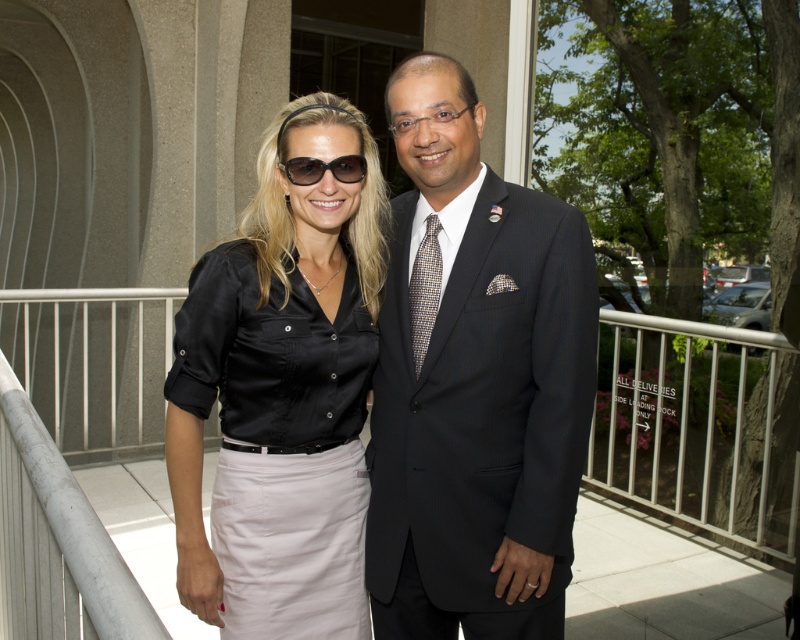
Between point (448, 552) and point (316, 524), which one is positioned in front?

Point (448, 552)

Does dark pinstripe suit at center lie behind satin black blouse at center?

Yes.

Who is more forward, (521,422) or (324,264)?

Point (521,422) is in front.

At what (x,y) coordinates should I click in order to perform the action: click on dark pinstripe suit at center. Please return your answer as a coordinate pair (x, y). This screenshot has width=800, height=640. Looking at the image, I should click on (476, 387).

Between dark pinstripe suit at center and sunglasses at center, which one is positioned higher?

Positioned higher is sunglasses at center.

Can you confirm if dark pinstripe suit at center is positioned to the left of sunglasses at center?

Incorrect, dark pinstripe suit at center is not on the left side of sunglasses at center.

Is point (486, 525) behind point (304, 164)?

Yes, it is behind point (304, 164).

The image size is (800, 640). Find the location of `dark pinstripe suit at center`. dark pinstripe suit at center is located at coordinates (476, 387).

Is dark pinstripe suit at center thinner than multicolored woven tie at center?

No.

Does dark pinstripe suit at center appear on the left side of multicolored woven tie at center?

No, dark pinstripe suit at center is not to the left of multicolored woven tie at center.

At what (x,y) coordinates should I click in order to perform the action: click on dark pinstripe suit at center. Please return your answer as a coordinate pair (x, y). This screenshot has width=800, height=640. Looking at the image, I should click on (476, 387).